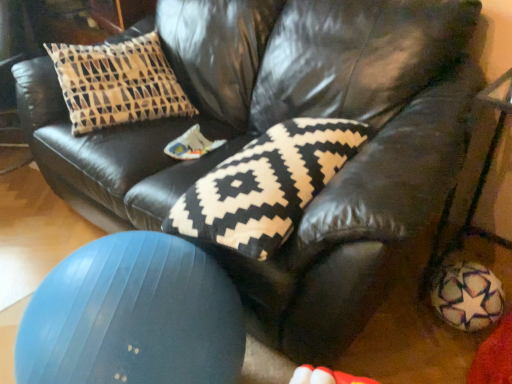
Find the location of a particular element. Image resolution: width=512 pixels, height=384 pixels. black and white knitted pillow at center is located at coordinates click(x=266, y=185).

The image size is (512, 384). What do you see at coordinates (266, 185) in the screenshot?
I see `black and white knitted pillow at center` at bounding box center [266, 185].

The height and width of the screenshot is (384, 512). What do you see at coordinates (133, 317) in the screenshot?
I see `blue rubber ball at lower left` at bounding box center [133, 317].

I want to click on blue rubber ball at lower left, so click(133, 317).

What are the coordinates of `black and white knitted pillow at center` in the screenshot? It's located at (266, 185).

In the image, is blue rubber ball at lower left on the left side or the right side of black and white knitted pillow at center?

From the image, it's evident that blue rubber ball at lower left is to the left of black and white knitted pillow at center.

Considering the relative positions of blue rubber ball at lower left and black and white knitted pillow at center in the image provided, is blue rubber ball at lower left behind black and white knitted pillow at center?

No, blue rubber ball at lower left is closer to the viewer.

Considering the positions of points (112, 302) and (228, 191), is point (112, 302) closer to camera compared to point (228, 191)?

Yes, point (112, 302) is closer to viewer.

From the picture: From the image's perspective, is blue rubber ball at lower left beneath black and white knitted pillow at center?

Yes, from the image's perspective, blue rubber ball at lower left is below black and white knitted pillow at center.

From the picture: From a real-world perspective, between blue rubber ball at lower left and black and white knitted pillow at center, who is vertically higher?

black and white knitted pillow at center, from a real-world perspective.

Does blue rubber ball at lower left have a lesser width compared to black and white knitted pillow at center?

Indeed, blue rubber ball at lower left has a lesser width compared to black and white knitted pillow at center.

Considering the relative sizes of blue rubber ball at lower left and black and white knitted pillow at center in the image provided, is blue rubber ball at lower left taller than black and white knitted pillow at center?

Yes.

Is blue rubber ball at lower left bigger or smaller than black and white knitted pillow at center?

In the image, blue rubber ball at lower left appears to be larger than black and white knitted pillow at center.

Is blue rubber ball at lower left not inside black and white knitted pillow at center?

Yes, blue rubber ball at lower left is outside of black and white knitted pillow at center.

Is blue rubber ball at lower left with black and white knitted pillow at center?

No, blue rubber ball at lower left is not in contact with black and white knitted pillow at center.

Does blue rubber ball at lower left turn towards black and white knitted pillow at center?

No, blue rubber ball at lower left is not aimed at black and white knitted pillow at center.

How far apart are blue rubber ball at lower left and black and white knitted pillow at center?

blue rubber ball at lower left is 10.10 inches from black and white knitted pillow at center.

Identify the location of pillow behind the blue rubber ball at lower left. Image resolution: width=512 pixels, height=384 pixels. (266, 185).

Can you confirm if black and white knitted pillow at center is positioned to the right of blue rubber ball at lower left?

Indeed, black and white knitted pillow at center is positioned on the right side of blue rubber ball at lower left.

Is the depth of black and white knitted pillow at center less than that of blue rubber ball at lower left?

No, it is not.

Is point (289, 226) farther from viewer compared to point (86, 252)?

Yes, point (289, 226) is farther from viewer.

From the image's perspective, which one is positioned higher, black and white knitted pillow at center or blue rubber ball at lower left?

black and white knitted pillow at center appears higher in the image.

From a real-world perspective, which object rests below the other?

blue rubber ball at lower left.

From the picture: Considering the relative sizes of black and white knitted pillow at center and blue rubber ball at lower left in the image provided, is black and white knitted pillow at center thinner than blue rubber ball at lower left?

In fact, black and white knitted pillow at center might be wider than blue rubber ball at lower left.

Is black and white knitted pillow at center taller or shorter than blue rubber ball at lower left?

black and white knitted pillow at center is shorter than blue rubber ball at lower left.

Considering the relative sizes of black and white knitted pillow at center and blue rubber ball at lower left in the image provided, is black and white knitted pillow at center smaller than blue rubber ball at lower left?

Yes.

Does black and white knitted pillow at center contain blue rubber ball at lower left?

No, blue rubber ball at lower left is located outside of black and white knitted pillow at center.

Is black and white knitted pillow at center far from blue rubber ball at lower left?

black and white knitted pillow at center is near blue rubber ball at lower left, not far away.

Is black and white knitted pillow at center positioned with its back to blue rubber ball at lower left?

No.

What's the angular difference between black and white knitted pillow at center and blue rubber ball at lower left's facing directions?

The angle between the facing direction of black and white knitted pillow at center and the facing direction of blue rubber ball at lower left is 8.71 degrees.

The image size is (512, 384). I want to click on pillow located on the right of blue rubber ball at lower left, so click(x=266, y=185).

I want to click on ball in front of the black and white knitted pillow at center, so click(133, 317).

Locate an element on the screen. The height and width of the screenshot is (384, 512). pillow behind the blue rubber ball at lower left is located at coordinates (266, 185).